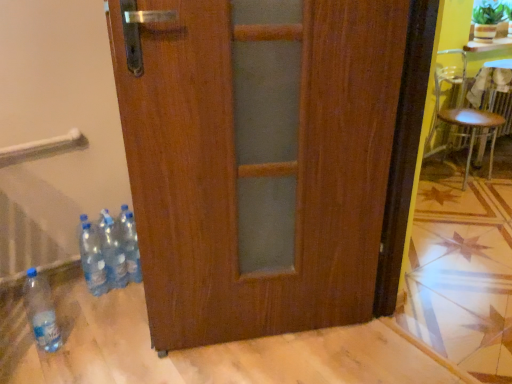
Image resolution: width=512 pixels, height=384 pixels. Identify the location of free space behind transparent plastic bottle at lower left, positioned as the fourth bottle in right-to-left order. (76, 315).